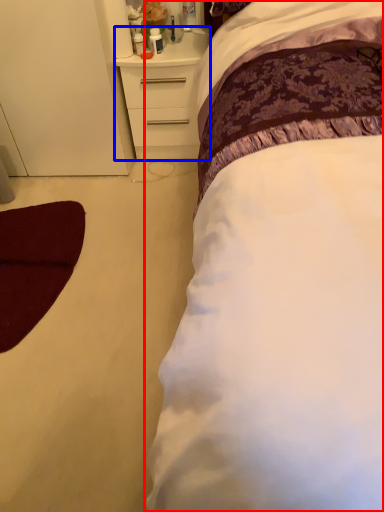
Question: Which object appears farthest to the camera in this image, bed (highlighted by a red box) or chest of drawers (highlighted by a blue box)?

Choices:
 (A) bed
 (B) chest of drawers

Answer: (B)